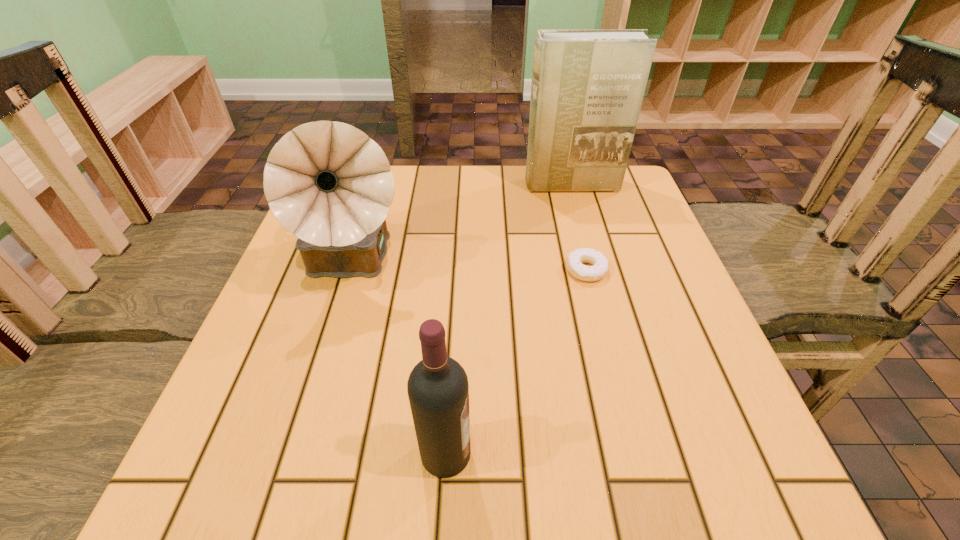
The height and width of the screenshot is (540, 960). I want to click on the farthest object, so click(587, 89).

I want to click on record player, so click(x=328, y=183).

Image resolution: width=960 pixels, height=540 pixels. Find the location of `the third tallest object`. the third tallest object is located at coordinates (438, 390).

You are a GUI agent. You are given a task and a screenshot of the screen. Output one action in this format:
    pyautogui.click(x=<x>, y=<y>)
    Task: Click on the nearest object
    This screenshot has height=540, width=960.
    Given the screenshot: What is the action you would take?
    click(x=438, y=390)

Locate an element on the screen. the shortest object is located at coordinates (575, 259).

Image resolution: width=960 pixels, height=540 pixels. What are the coordinates of `free space located on the cover of the farthest object` in the screenshot? It's located at click(x=578, y=212).

Where is `free region located 0.230m from the horn of the record player`? free region located 0.230m from the horn of the record player is located at coordinates (304, 421).

Where is `blank space located on the label of the third tallest object`? This screenshot has width=960, height=540. blank space located on the label of the third tallest object is located at coordinates coord(655,454).

I want to click on vacant space located on the right of the doughnut, so click(654, 270).

The width and height of the screenshot is (960, 540). Find the location of `object present at the far edge`. object present at the far edge is located at coordinates (587, 89).